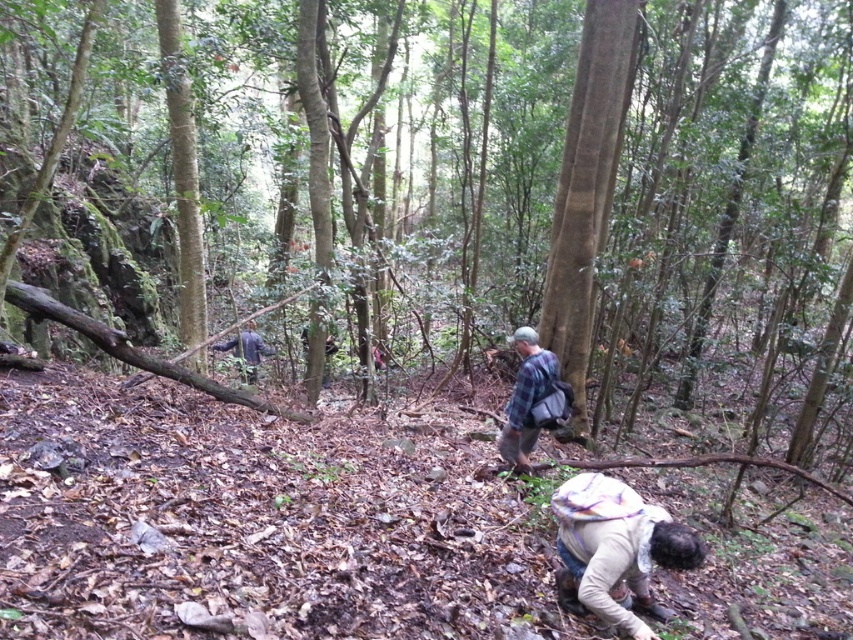
Looking at this image, who is higher up, light beige fabric backpack at lower center or plaid fabric shirt at center?

plaid fabric shirt at center is higher up.

Is light beige fabric backpack at lower center above plaid fabric shirt at center?

Incorrect, light beige fabric backpack at lower center is not positioned above plaid fabric shirt at center.

Which is in front, point (666, 512) or point (560, 396)?

Point (666, 512)

Identify the location of light beige fabric backpack at lower center. The image size is (853, 640). (616, 548).

Is brown rough bark tree at center taller than light beige fabric backpack at lower center?

Yes.

Is brown rough bark tree at center behind light beige fabric backpack at lower center?

That is True.

Is point (567, 141) positioned behind point (601, 532)?

That is True.

At what (x,y) coordinates should I click in order to perform the action: click on brown rough bark tree at center. Please return your answer as a coordinate pair (x, y). Looking at the image, I should click on (585, 186).

Is brown rough tree at center thinner than light beige fabric backpack at lower center?

No.

You are a GUI agent. You are given a task and a screenshot of the screen. Output one action in this format:
    pyautogui.click(x=<x>, y=<y>)
    Task: Click on the brown rough tree at center
    The width and height of the screenshot is (853, 640).
    Given the screenshot: What is the action you would take?
    pyautogui.click(x=582, y=193)

You are a GUI agent. You are given a task and a screenshot of the screen. Output one action in this format:
    pyautogui.click(x=<x>, y=<y>)
    Task: Click on the brown rough tree at center
    Image resolution: width=853 pixels, height=640 pixels.
    Given the screenshot: What is the action you would take?
    pyautogui.click(x=582, y=193)